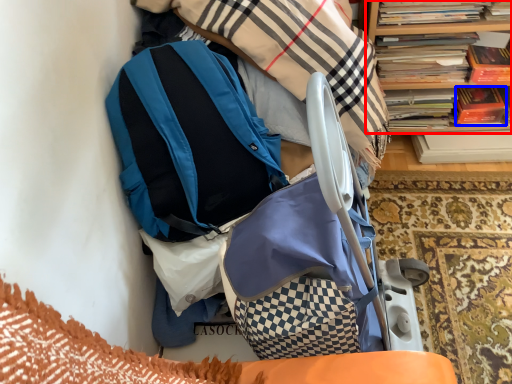
Question: Which object appears closest to the camera in this image, bookcase (highlighted by a red box) or paperback book (highlighted by a blue box)?

Choices:
 (A) bookcase
 (B) paperback book

Answer: (A)